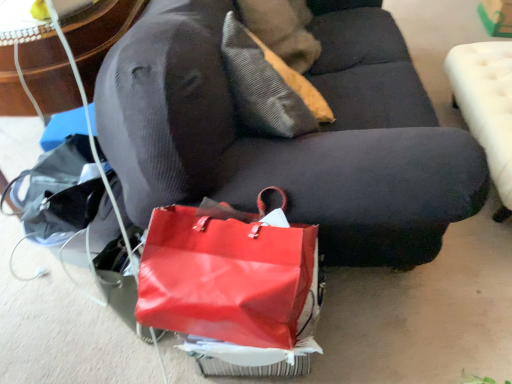
Question: Considering the relative positions of textured beige pillow at upper center and white tufted ottoman at right in the image provided, is textured beige pillow at upper center behind white tufted ottoman at right?

Choices:
 (A) no
 (B) yes

Answer: (B)

Question: Is textured beige pillow at upper center at the left side of white tufted ottoman at right?

Choices:
 (A) yes
 (B) no

Answer: (A)

Question: From the image's perspective, does textured beige pillow at upper center appear lower than white tufted ottoman at right?

Choices:
 (A) yes
 (B) no

Answer: (B)

Question: Does textured beige pillow at upper center have a smaller size compared to white tufted ottoman at right?

Choices:
 (A) yes
 (B) no

Answer: (A)

Question: Does textured beige pillow at upper center appear on the right side of white tufted ottoman at right?

Choices:
 (A) no
 (B) yes

Answer: (A)

Question: From a real-world perspective, is textured beige pillow at upper center over white tufted ottoman at right?

Choices:
 (A) no
 (B) yes

Answer: (B)

Question: Is shiny red handbag at lower center taller than white tufted ottoman at right?

Choices:
 (A) yes
 (B) no

Answer: (B)

Question: Considering the relative sizes of shiny red handbag at lower center and white tufted ottoman at right in the image provided, is shiny red handbag at lower center thinner than white tufted ottoman at right?

Choices:
 (A) no
 (B) yes

Answer: (B)

Question: Is shiny red handbag at lower center next to white tufted ottoman at right and touching it?

Choices:
 (A) no
 (B) yes

Answer: (A)

Question: Is the position of shiny red handbag at lower center more distant than that of white tufted ottoman at right?

Choices:
 (A) yes
 (B) no

Answer: (B)

Question: Is shiny red handbag at lower center positioned far away from white tufted ottoman at right?

Choices:
 (A) yes
 (B) no

Answer: (A)

Question: From a real-world perspective, is shiny red handbag at lower center beneath white tufted ottoman at right?

Choices:
 (A) yes
 (B) no

Answer: (B)

Question: Is textured beige pillow at upper center to the right of velvet dark gray couch at center from the viewer's perspective?

Choices:
 (A) yes
 (B) no

Answer: (B)